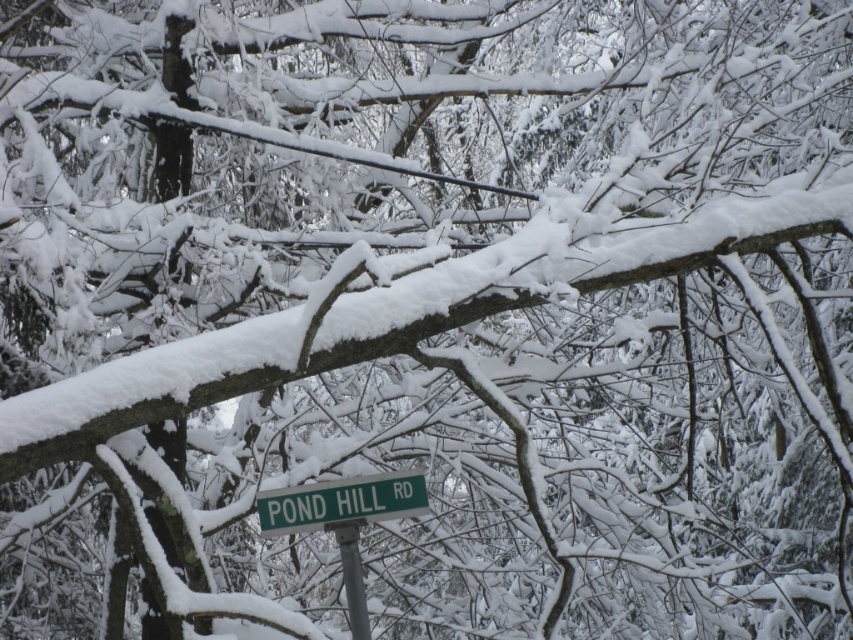
Who is lower down, green plastic street sign at center or metallic gray pole at center?

metallic gray pole at center

Does green plastic street sign at center appear on the right side of metallic gray pole at center?

No, green plastic street sign at center is not to the right of metallic gray pole at center.

Locate an element on the screen. Image resolution: width=853 pixels, height=640 pixels. green plastic street sign at center is located at coordinates (341, 502).